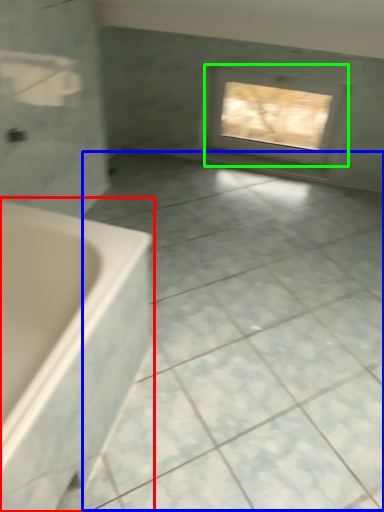
Question: Estimate the real-world distances between objects in this image. Which object is closer to bathtub (highlighted by a red box), ceramic tile (highlighted by a blue box) or window (highlighted by a green box)?

Choices:
 (A) ceramic tile
 (B) window

Answer: (A)